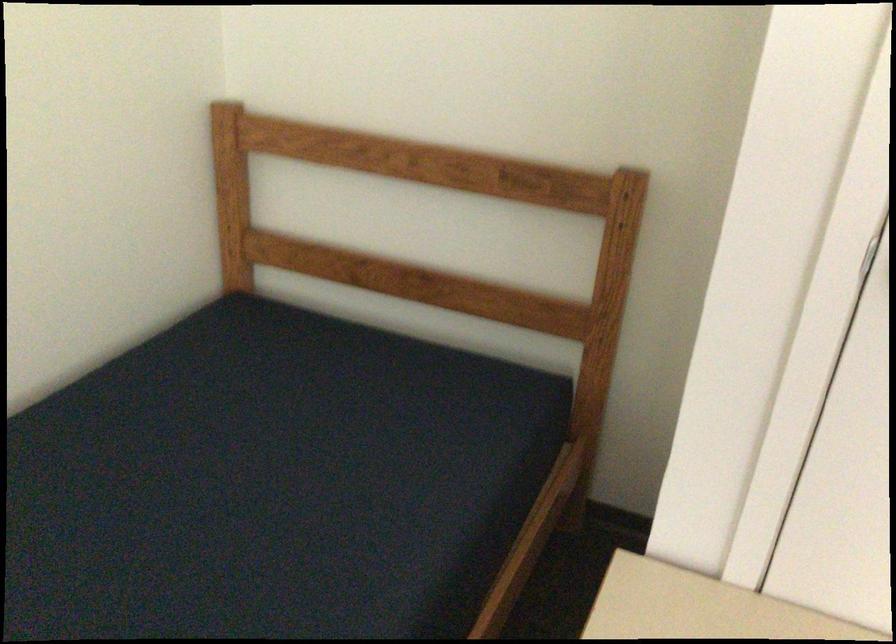
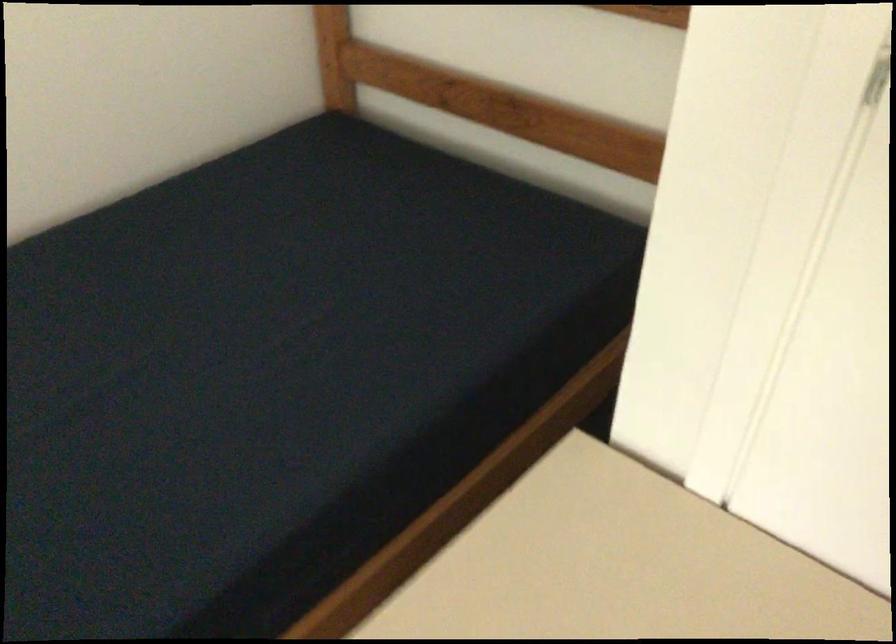
Question: The first image is from the beginning of the video and the second image is from the end. How did the camera likely rotate when shooting the video?

Choices:
 (A) Left
 (B) Right
 (C) Up
 (D) Down

Answer: (A)